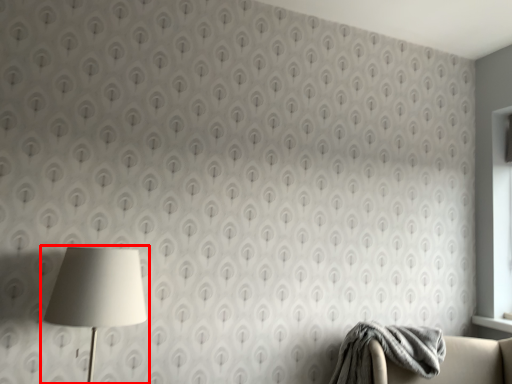
Question: From the image's perspective, considering the relative positions of lamp (annotated by the red box) and blanket in the image provided, where is lamp (annotated by the red box) located with respect to the staircase?

Choices:
 (A) below
 (B) above

Answer: (B)